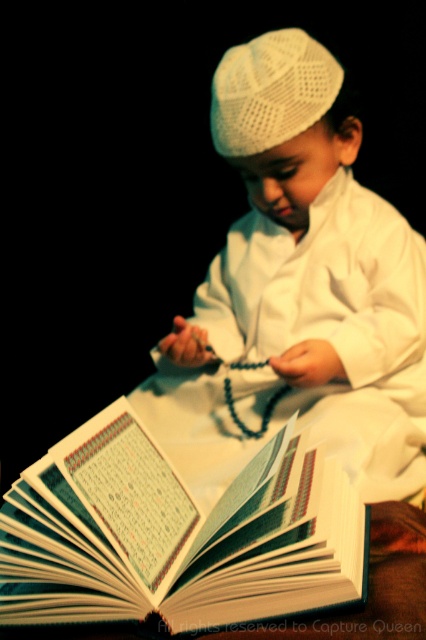
Does white matte/knit cap at upper center come in front of white knitted hat at center?

Yes, white matte/knit cap at upper center is in front of white knitted hat at center.

Looking at this image, who is higher up, white matte/knit cap at upper center or white knitted hat at center?

white knitted hat at center is above.

Between point (299, 301) and point (239, 93), which one is positioned behind?

Positioned behind is point (299, 301).

Locate an element on the screen. The image size is (426, 640). white matte/knit cap at upper center is located at coordinates (298, 291).

In the scene shown: Can you confirm if white paper book at center is positioned above white knitted hat at center?

Incorrect, white paper book at center is not positioned above white knitted hat at center.

The width and height of the screenshot is (426, 640). Describe the element at coordinates (175, 534) in the screenshot. I see `white paper book at center` at that location.

Identify the location of white paper book at center. The height and width of the screenshot is (640, 426). (175, 534).

Based on the photo, does white matte/knit cap at upper center appear over white paper book at center?

Indeed, white matte/knit cap at upper center is positioned over white paper book at center.

Can you confirm if white matte/knit cap at upper center is smaller than white paper book at center?

No, white matte/knit cap at upper center is not smaller than white paper book at center.

Which is behind, point (233, 60) or point (276, 547)?

Positioned behind is point (233, 60).

Find the location of a particular element. The height and width of the screenshot is (640, 426). white matte/knit cap at upper center is located at coordinates (298, 291).